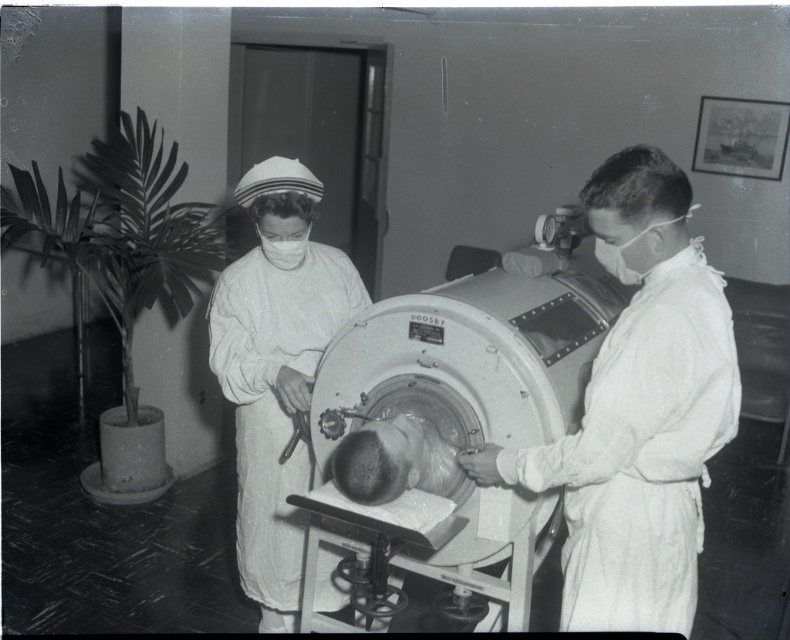
You are a medical student observing a historical medical setup. You notice the smooth white coat at center and the metallic cylindrical tank at center. Can you determine if the distance between them is sufficient to safely move a medical tray from one to the other without touching either?

The smooth white coat at center is 19.00 inches away from the metallic cylindrical tank at center. Since 19 inches provides enough space to maneuver a medical tray safely between them without contact, the distance is sufficient.

You are a medical student observing the scene. The white cloth nurse at center is holding a clipboard, and the matte white mask at center is hanging from a hook nearby. Which object is closer to the bottom edge of the image?

The white cloth nurse at center is positioned under the matte white mask at center, meaning it is closer to the bottom edge of the image.